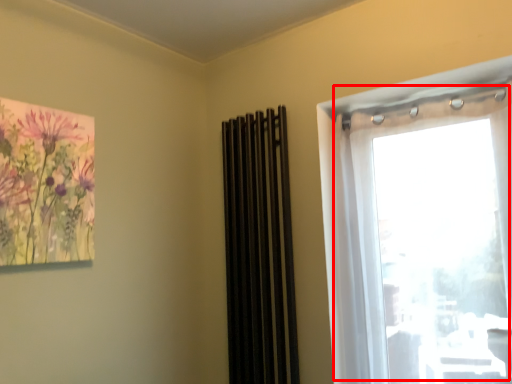
Question: From the image's perspective, where is window (annotated by the red box) located in relation to curtain in the image?

Choices:
 (A) above
 (B) below

Answer: (A)